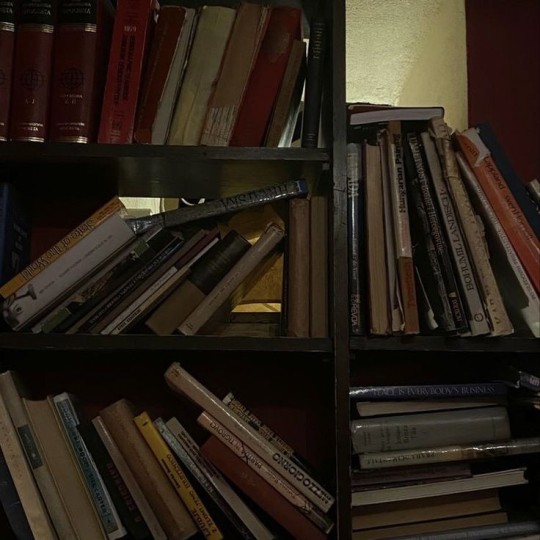
Where is `underneath the shelf`? underneath the shelf is located at coordinates (292, 363), (401, 363), (171, 185).